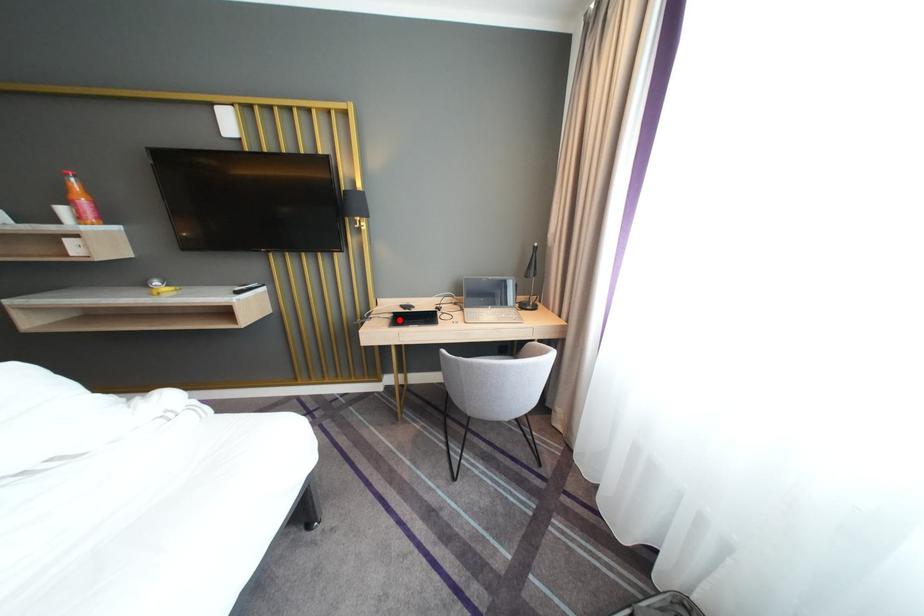
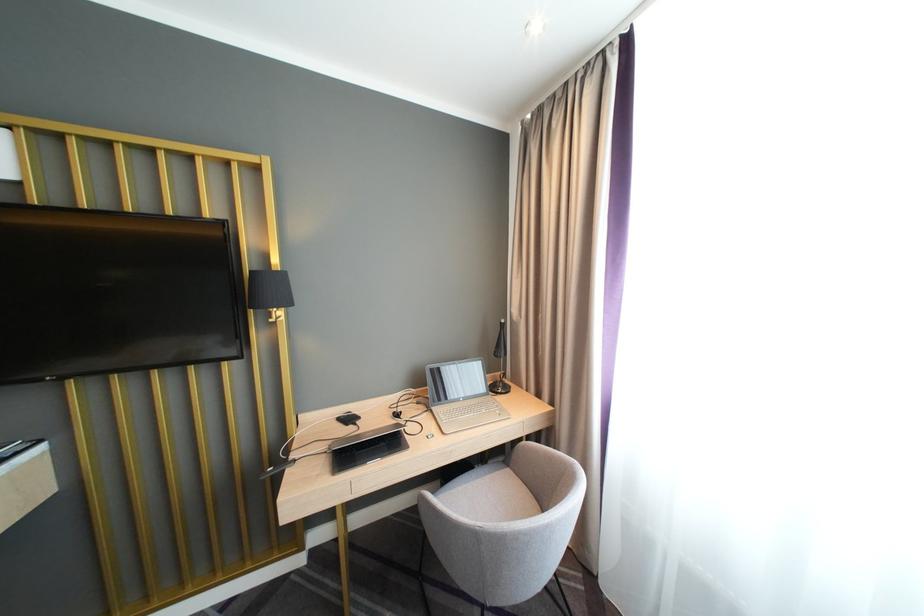
Find the pixel in the second image that matches the highlighted location in the first image.

(335, 456)